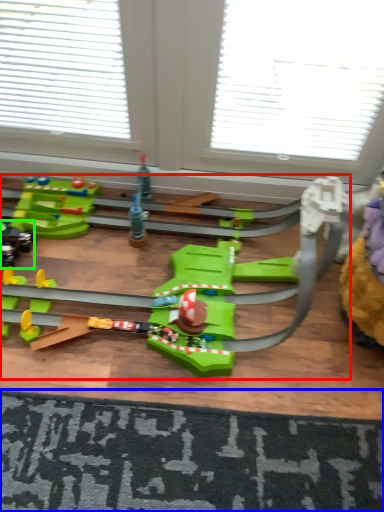
Question: Estimate the real-world distances between objects in this image. Which object is closer to toy (highlighted by a red box), doormat (highlighted by a blue box) or toy (highlighted by a green box)?

Choices:
 (A) doormat
 (B) toy

Answer: (A)